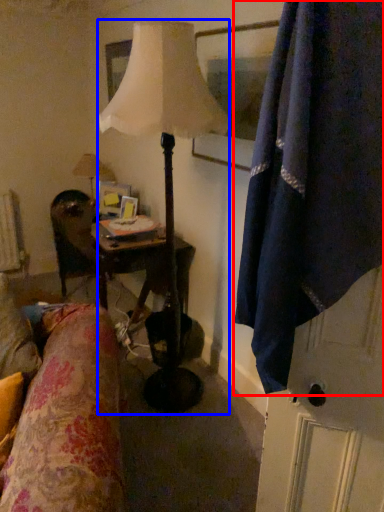
Question: Which point is further to the camera, curtain (highlighted by a red box) or lamp (highlighted by a blue box)?

Choices:
 (A) curtain
 (B) lamp

Answer: (B)